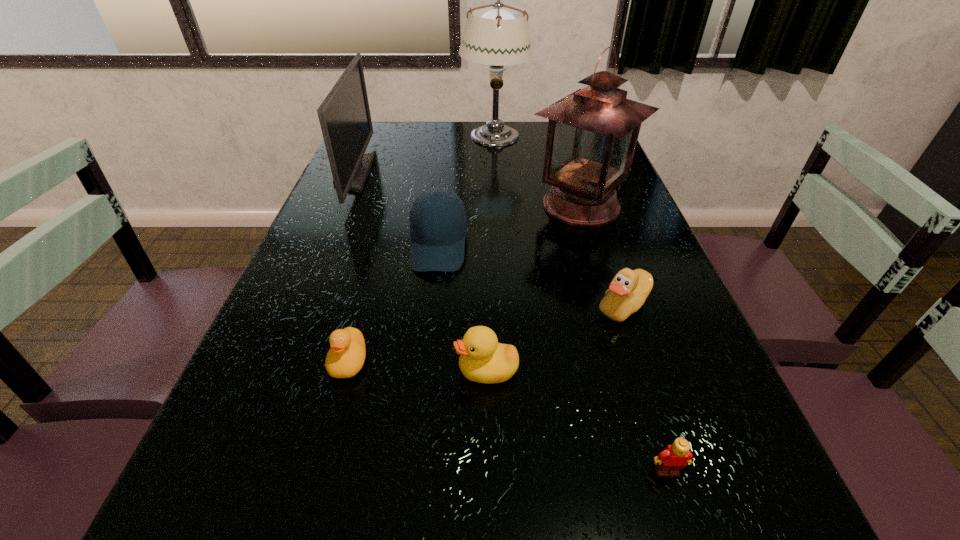
Locate an element on the screen. free region that satisfies the following two spatial constraints: 1. on the lampshade of the lampshade; 2. on the screen side of the third tallest object is located at coordinates (495, 173).

Locate an element on the screen. The height and width of the screenshot is (540, 960). vacant region that satisfies the following two spatial constraints: 1. at the beak of the fifth farthest object; 2. on the face of the shortest duck is located at coordinates (642, 361).